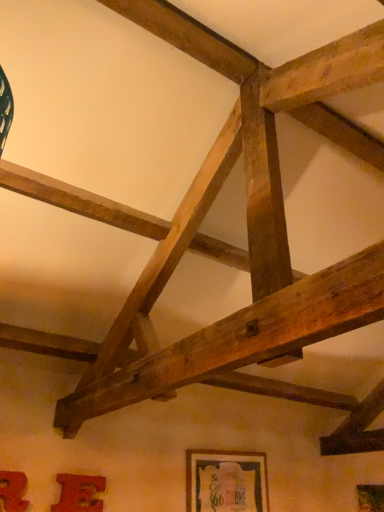
Question: Considering the relative sizes of matte red picture frame at lower left, acting as the 2th picture frame starting from the right, and wooden framed poster at lower center, the 1th picture frame viewed from the right, in the image provided, is matte red picture frame at lower left, acting as the 2th picture frame starting from the right, thinner than wooden framed poster at lower center, the 1th picture frame viewed from the right,?

Choices:
 (A) no
 (B) yes

Answer: (B)

Question: Can you confirm if matte red picture frame at lower left, the second picture frame viewed from the front, is positioned to the left of wooden framed poster at lower center, which is the third picture frame in left-to-right order?

Choices:
 (A) no
 (B) yes

Answer: (B)

Question: Considering the relative sizes of matte red picture frame at lower left, which is counted as the second picture frame, starting from the back, and wooden framed poster at lower center, positioned as the 1th picture frame in back-to-front order, in the image provided, is matte red picture frame at lower left, which is counted as the second picture frame, starting from the back, wider than wooden framed poster at lower center, positioned as the 1th picture frame in back-to-front order,?

Choices:
 (A) yes
 (B) no

Answer: (B)

Question: Is matte red picture frame at lower left, acting as the 2th picture frame starting from the right, next to wooden framed poster at lower center, the 1th picture frame viewed from the right, and touching it?

Choices:
 (A) no
 (B) yes

Answer: (A)

Question: Considering the relative sizes of matte red picture frame at lower left, which is counted as the second picture frame, starting from the back, and wooden framed poster at lower center, the 1th picture frame viewed from the right, in the image provided, is matte red picture frame at lower left, which is counted as the second picture frame, starting from the back, taller than wooden framed poster at lower center, the 1th picture frame viewed from the right,?

Choices:
 (A) no
 (B) yes

Answer: (A)

Question: Can you confirm if matte red picture frame at lower left, which is counted as the second picture frame, starting from the back, is positioned to the right of wooden framed poster at lower center, which is counted as the 3th picture frame, starting from the front?

Choices:
 (A) yes
 (B) no

Answer: (B)

Question: Is matte red picture frame at lower left, which is the first picture frame in front-to-back order, at the back of wooden framed poster at lower center, which is the third picture frame in left-to-right order?

Choices:
 (A) yes
 (B) no

Answer: (B)

Question: Is wooden framed poster at lower center, which is counted as the 3th picture frame, starting from the front, behind matte red picture frame at lower left, which is the 1th picture frame in left-to-right order?

Choices:
 (A) no
 (B) yes

Answer: (B)

Question: From the image's perspective, does wooden framed poster at lower center, which is counted as the 3th picture frame, starting from the front, appear higher than matte red picture frame at lower left, acting as the third picture frame starting from the right?

Choices:
 (A) no
 (B) yes

Answer: (A)

Question: Does wooden framed poster at lower center, the 1th picture frame viewed from the right, have a greater width compared to matte red picture frame at lower left, which is the first picture frame in front-to-back order?

Choices:
 (A) yes
 (B) no

Answer: (A)

Question: From a real-world perspective, is wooden framed poster at lower center, which is the third picture frame in left-to-right order, located beneath matte red picture frame at lower left, acting as the third picture frame starting from the right?

Choices:
 (A) no
 (B) yes

Answer: (A)

Question: Is wooden framed poster at lower center, which is counted as the 3th picture frame, starting from the front, to the left of matte red picture frame at lower left, which appears as the third picture frame when viewed from the back, from the viewer's perspective?

Choices:
 (A) yes
 (B) no

Answer: (B)

Question: Considering the relative sizes of wooden framed poster at lower center, which is counted as the 3th picture frame, starting from the front, and matte red picture frame at lower left, which is counted as the second picture frame, starting from the back, in the image provided, is wooden framed poster at lower center, which is counted as the 3th picture frame, starting from the front, shorter than matte red picture frame at lower left, which is counted as the second picture frame, starting from the back,?

Choices:
 (A) no
 (B) yes

Answer: (A)